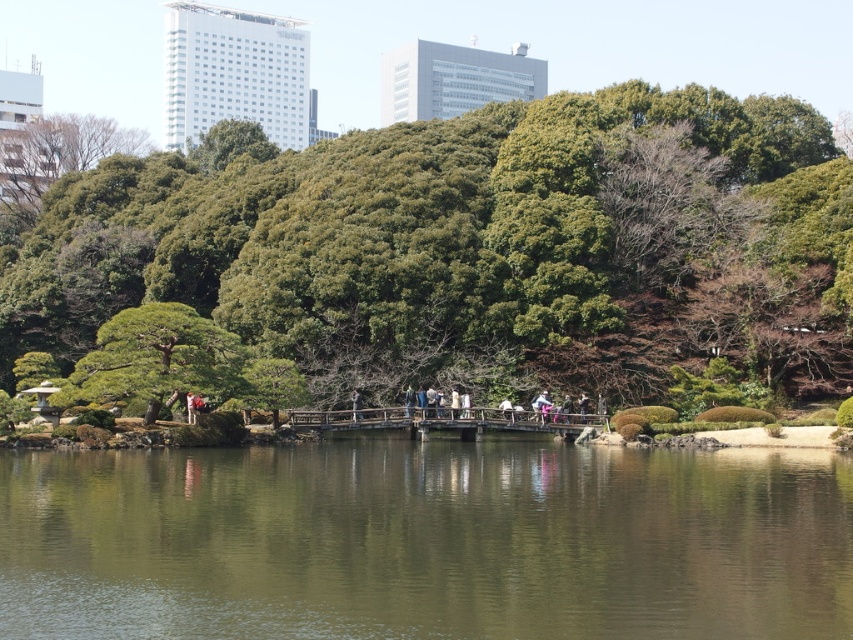
Is point (194, 580) farther from camera compared to point (97, 339)?

No, (194, 580) is in front of (97, 339).

Is point (821, 509) closer to camera compared to point (131, 358)?

Yes, it is in front of point (131, 358).

Locate an element on the screen. The width and height of the screenshot is (853, 640). green reflective water at center is located at coordinates (425, 541).

Does green leafy tree at center have a smaller size compared to green reflective water at center?

No.

Who is positioned more to the right, green leafy tree at center or green reflective water at center?

Positioned to the right is green reflective water at center.

Who is more distant from viewer, (607,320) or (518,461)?

The point (607,320) is more distant.

At what (x,y) coordinates should I click in order to perform the action: click on green leafy tree at center. Please return your answer as a coordinate pair (x, y). Looking at the image, I should click on (473, 246).

Does green leafy tree at center have a lesser width compared to green textured tree at center?

Incorrect, green leafy tree at center's width is not less than green textured tree at center's.

You are a GUI agent. You are given a task and a screenshot of the screen. Output one action in this format:
    pyautogui.click(x=<x>, y=<y>)
    Task: Click on the green leafy tree at center
    
    Given the screenshot: What is the action you would take?
    pyautogui.click(x=473, y=246)

In order to click on green leafy tree at center in this screenshot , I will do `click(473, 246)`.